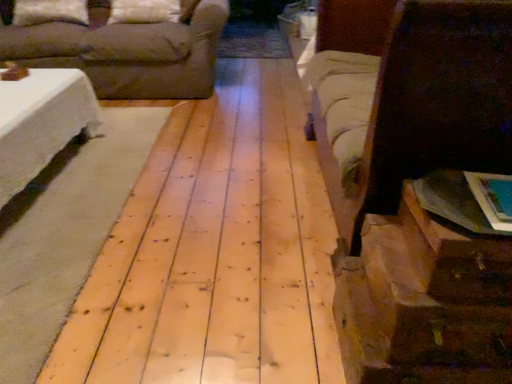
Locate an element on the screen. The width and height of the screenshot is (512, 384). brown fabric bed at right is located at coordinates (407, 98).

Describe the element at coordinates (121, 44) in the screenshot. I see `brown fabric couch at upper left` at that location.

Locate an element on the screen. Image resolution: width=512 pixels, height=384 pixels. brown fabric bed at right is located at coordinates (407, 98).

Who is more distant, natural wood floor at center or brown paper bag at lower right?

Positioned behind is natural wood floor at center.

Does natural wood floor at center have a lesser height compared to brown paper bag at lower right?

Indeed, natural wood floor at center has a lesser height compared to brown paper bag at lower right.

From a real-world perspective, which object stands above the other?

brown paper bag at lower right is physically above.

Who is bigger, natural wood floor at center or brown paper bag at lower right?

natural wood floor at center is bigger.

Consider the image. Which is in front, brown paper bag at lower right or natural wood floor at center?

brown paper bag at lower right is closer to the camera.

From a real-world perspective, which is physically above, brown paper bag at lower right or natural wood floor at center?

A: brown paper bag at lower right, from a real-world perspective.

How distant is brown paper bag at lower right from natural wood floor at center?

They are 30.45 inches apart.

Is brown paper bag at lower right not inside natural wood floor at center?

brown paper bag at lower right lies outside natural wood floor at center's area.

In the scene shown: Can you confirm if white fabric pillow at upper center, arranged as the 1th pillow when viewed from the right, is positioned to the left of natural wood floor at center?

Indeed, white fabric pillow at upper center, arranged as the 1th pillow when viewed from the right, is positioned on the left side of natural wood floor at center.

Would you say white fabric pillow at upper center, the 2th pillow positioned from the left, is outside natural wood floor at center?

Yes.

Does point (173, 3) appear closer or farther from the camera than point (267, 341)?

Point (173, 3) is positioned farther from the camera compared to point (267, 341).

At what (x,y) coordinates should I click in order to perform the action: click on the 2nd pillow above when counting from the natural wood floor at center (from the image's perspective). Please return your answer as a coordinate pair (x, y). Looking at the image, I should click on (144, 11).

Considering the relative sizes of white fabric pillow at upper center, arranged as the 1th pillow when viewed from the right, and white soft pillow at upper left, positioned as the 2th pillow in right-to-left order, in the image provided, is white fabric pillow at upper center, arranged as the 1th pillow when viewed from the right, wider than white soft pillow at upper left, positioned as the 2th pillow in right-to-left order,?

Incorrect, the width of white fabric pillow at upper center, arranged as the 1th pillow when viewed from the right, does not surpass that of white soft pillow at upper left, positioned as the 2th pillow in right-to-left order.

From a real-world perspective, is white fabric pillow at upper center, arranged as the 1th pillow when viewed from the right, physically located above or below white soft pillow at upper left, positioned as the 2th pillow in right-to-left order?

In terms of real-world spatial position, white fabric pillow at upper center, arranged as the 1th pillow when viewed from the right, is above white soft pillow at upper left, positioned as the 2th pillow in right-to-left order.

Identify the location of pillow above the white soft pillow at upper left, positioned as the 2th pillow in right-to-left order (from a real-world perspective). The image size is (512, 384). (144, 11).

Is point (179, 11) more distant than point (47, 11)?

No, it is in front of (47, 11).

Consider the image. Is white soft pillow at upper left, positioned as the 2th pillow in right-to-left order, shorter than white fabric pillow at upper center, arranged as the 1th pillow when viewed from the right?

Correct, white soft pillow at upper left, positioned as the 2th pillow in right-to-left order, is not as tall as white fabric pillow at upper center, arranged as the 1th pillow when viewed from the right.

Is white soft pillow at upper left, positioned as the 2th pillow in right-to-left order, bigger or smaller than white fabric pillow at upper center, arranged as the 1th pillow when viewed from the right?

Clearly, white soft pillow at upper left, positioned as the 2th pillow in right-to-left order, is larger in size than white fabric pillow at upper center, arranged as the 1th pillow when viewed from the right.

Is white soft pillow at upper left, positioned as the 2th pillow in right-to-left order, not inside white fabric pillow at upper center, the 2th pillow positioned from the left?

Yes, white soft pillow at upper left, positioned as the 2th pillow in right-to-left order, is located beyond the bounds of white fabric pillow at upper center, the 2th pillow positioned from the left.

Can you confirm if brown paper bag at lower right is smaller than brown fabric couch at upper left?

Indeed, brown paper bag at lower right has a smaller size compared to brown fabric couch at upper left.

Considering the relative sizes of brown paper bag at lower right and brown fabric couch at upper left in the image provided, is brown paper bag at lower right taller than brown fabric couch at upper left?

No, brown paper bag at lower right is not taller than brown fabric couch at upper left.

Can you tell me how much brown paper bag at lower right and brown fabric couch at upper left differ in facing direction?

The facing directions of brown paper bag at lower right and brown fabric couch at upper left are 90.8 degrees apart.

Is the position of brown paper bag at lower right less distant than that of brown fabric couch at upper left?

Yes, brown paper bag at lower right is in front of brown fabric couch at upper left.

In order to click on plywood in front of the white fabric pillow at upper center, arranged as the 1th pillow when viewed from the right in this screenshot , I will do `click(215, 251)`.

Visually, is natural wood floor at center positioned to the left or to the right of white fabric pillow at upper center, the 2th pillow positioned from the left?

In the image, natural wood floor at center appears on the right side of white fabric pillow at upper center, the 2th pillow positioned from the left.

Looking at this image, from a real-world perspective, is natural wood floor at center positioned above or below white fabric pillow at upper center, arranged as the 1th pillow when viewed from the right?

Clearly, from a real-world perspective, natural wood floor at center is below white fabric pillow at upper center, arranged as the 1th pillow when viewed from the right.

Which point is more forward, (261, 242) or (160, 18)?

The point (261, 242) is in front.

What are the coordinates of `drawer in front of the natural wood floor at center` in the screenshot? It's located at (459, 245).

Image resolution: width=512 pixels, height=384 pixels. I want to click on plywood that is above the brown paper bag at lower right (from the image's perspective), so tap(215, 251).

Considering their positions, is white soft pillow at upper left, positioned as the 2th pillow in right-to-left order, positioned closer to brown fabric couch at upper left than brown fabric bed at right?

Based on the image, white soft pillow at upper left, positioned as the 2th pillow in right-to-left order, appears to be nearer to brown fabric couch at upper left.

Looking at the image, which one is located closer to white soft pillow at upper left, which is the 1th pillow from left to right, brown fabric bed at right or brown paper bag at lower right?

brown fabric bed at right is closer to white soft pillow at upper left, which is the 1th pillow from left to right.

When comparing their distances from natural wood floor at center, does white soft pillow at upper left, positioned as the 2th pillow in right-to-left order, or brown fabric couch at upper left seem closer?

Based on the image, brown fabric couch at upper left appears to be nearer to natural wood floor at center.

From the image, which object appears to be farther from brown fabric couch at upper left, white soft pillow at upper left, which is the 1th pillow from left to right, or natural wood floor at center?

natural wood floor at center is positioned further to the anchor brown fabric couch at upper left.

Based on their spatial positions, is brown fabric couch at upper left or brown fabric bed at right closer to natural wood floor at center?

brown fabric bed at right.

From the image, which object appears to be nearer to brown fabric couch at upper left, brown fabric bed at right or natural wood floor at center?

natural wood floor at center lies closer to brown fabric couch at upper left than the other object.

When comparing their distances from brown fabric bed at right, does white soft pillow at upper left, which is the 1th pillow from left to right, or natural wood floor at center seem closer?

The object closer to brown fabric bed at right is natural wood floor at center.

Based on their spatial positions, is white fabric pillow at upper center, arranged as the 1th pillow when viewed from the right, or natural wood floor at center closer to white soft pillow at upper left, positioned as the 2th pillow in right-to-left order?

Based on the image, white fabric pillow at upper center, arranged as the 1th pillow when viewed from the right, appears to be nearer to white soft pillow at upper left, positioned as the 2th pillow in right-to-left order.

Locate an element on the screen. plywood between brown fabric bed at right and white fabric pillow at upper center, the 2th pillow positioned from the left, in the front-back direction is located at coordinates (215, 251).

What are the coordinates of `studio couch located between white soft pillow at upper left, which is the 1th pillow from left to right, and brown fabric bed at right in the left-right direction` in the screenshot? It's located at (121, 44).

Image resolution: width=512 pixels, height=384 pixels. I want to click on studio couch located between natural wood floor at center and white fabric pillow at upper center, the 2th pillow positioned from the left, in the depth direction, so click(121, 44).

The image size is (512, 384). I want to click on pillow between brown paper bag at lower right and white fabric pillow at upper center, arranged as the 1th pillow when viewed from the right, from front to back, so click(49, 12).